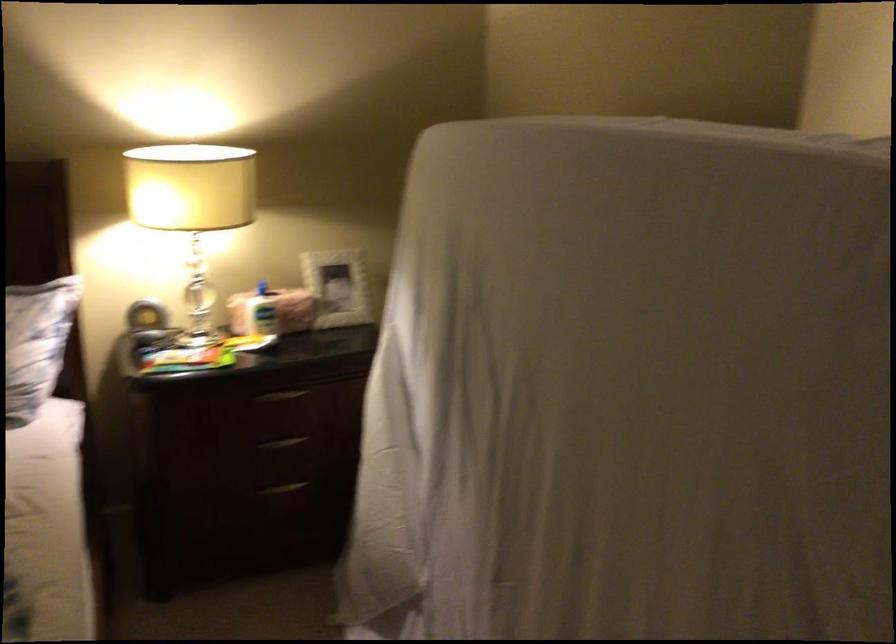
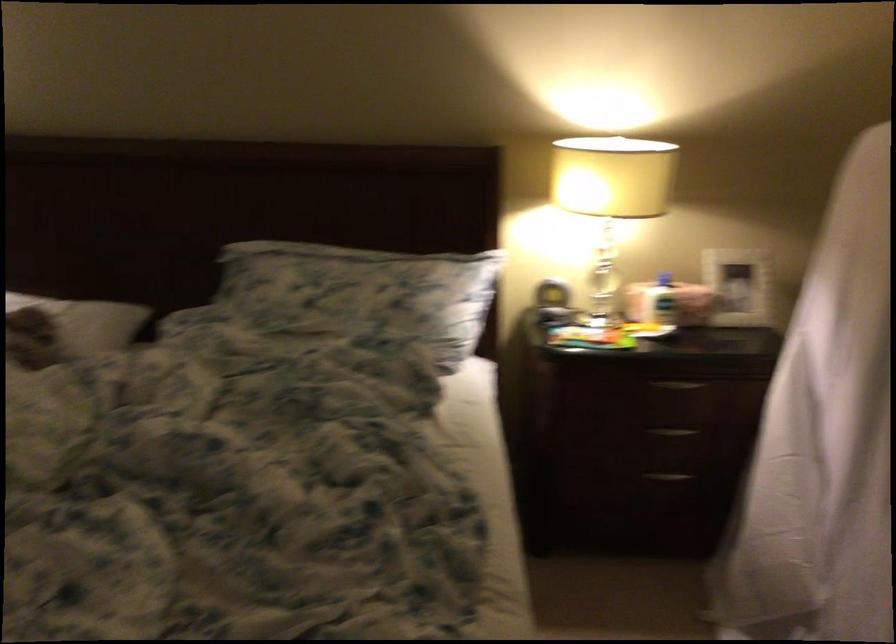
Question: The images are taken continuously from a first-person perspective. In which direction is your viewpoint rotating?

Choices:
 (A) Left
 (B) Right
 (C) Up
 (D) Down

Answer: (A)